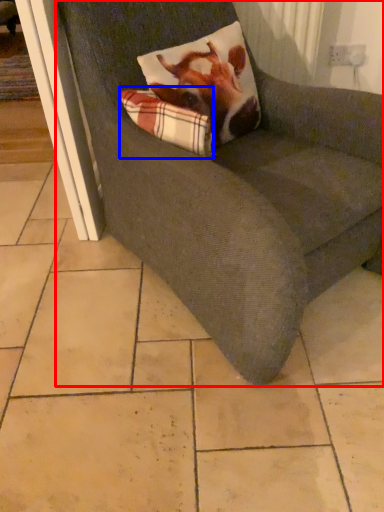
Question: Among these objects, which one is farthest to the camera, chair (highlighted by a red box) or plaid (highlighted by a blue box)?

Choices:
 (A) chair
 (B) plaid

Answer: (B)